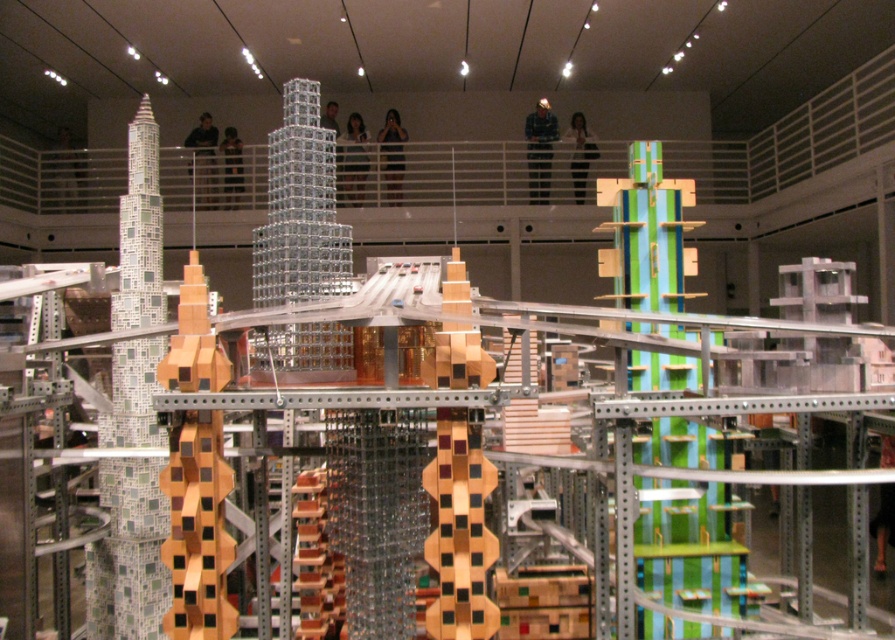
What is the name of the object located at the coordinates point (300, 209)?

The object located at point (300, 209) is the translucent glass tower at center.

You are an architect examining the architectural model from a front view. You notice two points marked on the model at coordinates point (279,289) and point (198,611). If you were to walk towards the model, which point would you encounter first?

Point (279,289) is further to the viewer than point (198,611), so you would encounter point (279,289) first as you approach the model.